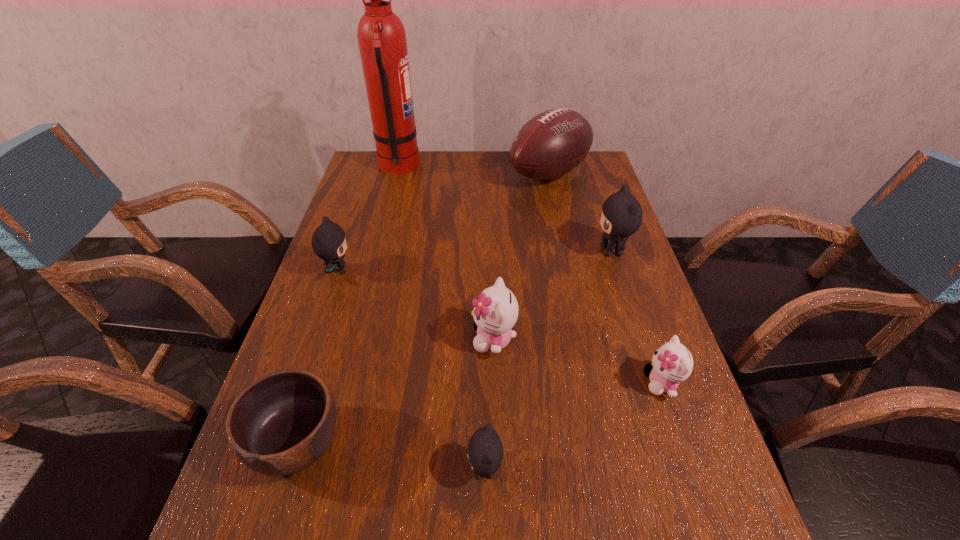
Image resolution: width=960 pixels, height=540 pixels. Find the location of `vacant area situated 0.270m on the label side of the fire extinguisher`. vacant area situated 0.270m on the label side of the fire extinguisher is located at coordinates (496, 167).

You are a GUI agent. You are given a task and a screenshot of the screen. Output one action in this format:
    pyautogui.click(x=<x>, y=<y>)
    Task: Click on the vacant area situated on the left of the second tallest object
    
    Given the screenshot: What is the action you would take?
    pyautogui.click(x=461, y=174)

You are a GUI agent. You are given a task and a screenshot of the screen. Output one action in this format:
    pyautogui.click(x=<x>, y=<y>)
    Task: Click on the blank space located 0.140m on the front-facing side of the biggest gray kitten
    The height and width of the screenshot is (540, 960).
    Given the screenshot: What is the action you would take?
    pyautogui.click(x=543, y=251)

Find the location of a particular element. The height and width of the screenshot is (540, 960). vacant position located on the front-facing side of the biggest gray kitten is located at coordinates (564, 251).

The height and width of the screenshot is (540, 960). What are the coordinates of `vacant space located on the front-facing side of the biggest gray kitten` in the screenshot? It's located at (546, 251).

Where is `vacant region located on the front-facing side of the bigger white kitten`? The image size is (960, 540). vacant region located on the front-facing side of the bigger white kitten is located at coordinates (319, 339).

The image size is (960, 540). What are the coordinates of `free space located on the front-facing side of the bigger white kitten` in the screenshot? It's located at (423, 339).

Locate an element on the screen. vacant space located 0.140m on the front-facing side of the bigger white kitten is located at coordinates (411, 339).

What are the coordinates of `vacant region located 0.150m on the front-facing side of the leftmost kitten` in the screenshot? It's located at (410, 270).

Find the location of a particular element. The image size is (960, 540). vacant area located 0.120m on the right of the bowl is located at coordinates (408, 443).